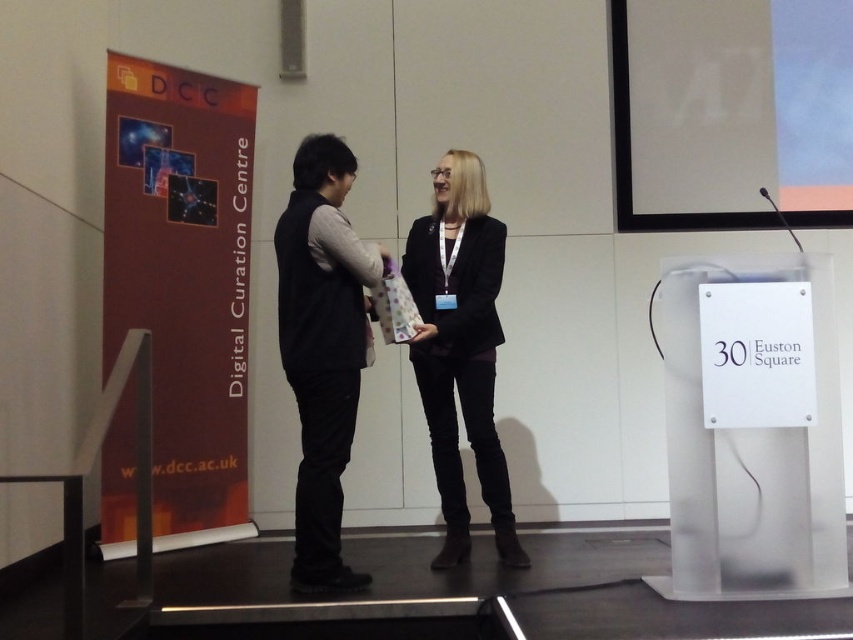
Measure the distance between black matte vest at center and black matte blazer at center.

black matte vest at center is 17.21 inches from black matte blazer at center.

Which of these two, black matte vest at center or black matte blazer at center, stands taller?

With more height is black matte blazer at center.

Which is in front, point (294, 496) or point (409, 268)?

Point (294, 496) is in front.

Locate an element on the screen. black matte vest at center is located at coordinates [x=323, y=348].